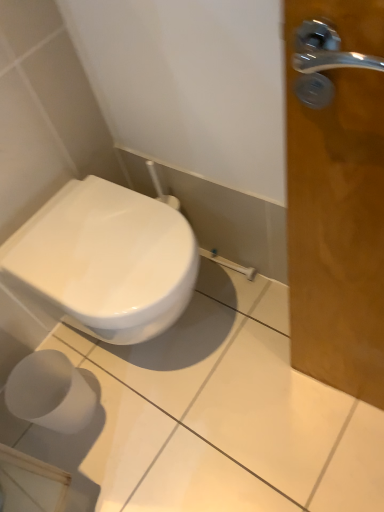
Question: Considering the relative positions of white glossy toilet at lower left and white matte toilet paper at lower left in the image provided, is white glossy toilet at lower left to the right of white matte toilet paper at lower left from the viewer's perspective?

Choices:
 (A) yes
 (B) no

Answer: (A)

Question: Considering the relative positions of white glossy toilet at lower left and white matte toilet paper at lower left in the image provided, is white glossy toilet at lower left in front of white matte toilet paper at lower left?

Choices:
 (A) yes
 (B) no

Answer: (A)

Question: From a real-world perspective, is white glossy toilet at lower left on top of white matte toilet paper at lower left?

Choices:
 (A) no
 (B) yes

Answer: (B)

Question: Does white glossy toilet at lower left have a larger size compared to white matte toilet paper at lower left?

Choices:
 (A) no
 (B) yes

Answer: (B)

Question: Considering the relative sizes of white glossy toilet at lower left and white matte toilet paper at lower left in the image provided, is white glossy toilet at lower left smaller than white matte toilet paper at lower left?

Choices:
 (A) yes
 (B) no

Answer: (B)

Question: Does white glossy toilet at lower left have a greater width compared to white matte toilet paper at lower left?

Choices:
 (A) no
 (B) yes

Answer: (B)

Question: Is white matte toilet paper at lower left smaller than white glossy toilet at lower left?

Choices:
 (A) no
 (B) yes

Answer: (B)

Question: Is white matte toilet paper at lower left closer to camera compared to white glossy toilet at lower left?

Choices:
 (A) yes
 (B) no

Answer: (B)

Question: Does white matte toilet paper at lower left have a larger size compared to white glossy toilet at lower left?

Choices:
 (A) no
 (B) yes

Answer: (A)

Question: Does white matte toilet paper at lower left have a greater width compared to white glossy toilet at lower left?

Choices:
 (A) yes
 (B) no

Answer: (B)

Question: Would you say white matte toilet paper at lower left is outside white glossy toilet at lower left?

Choices:
 (A) no
 (B) yes

Answer: (B)

Question: Are white matte toilet paper at lower left and white glossy toilet at lower left making contact?

Choices:
 (A) no
 (B) yes

Answer: (A)

Question: Considering the positions of point (31, 372) and point (183, 286), is point (31, 372) closer or farther from the camera than point (183, 286)?

Choices:
 (A) closer
 (B) farther

Answer: (B)